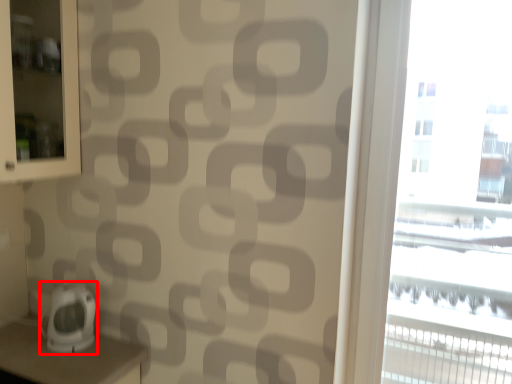
Question: From the image's perspective, where is appliance (annotated by the red box) located in relation to window in the image?

Choices:
 (A) below
 (B) above

Answer: (A)